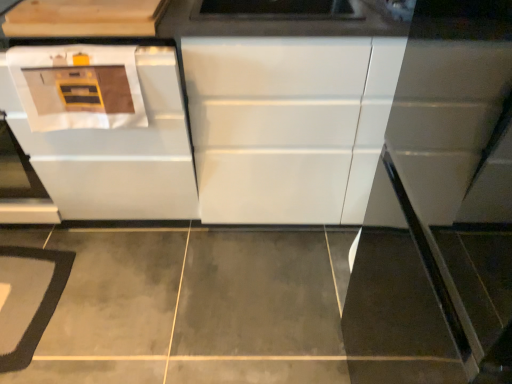
Question: Does light wood cabinet at upper left, the first cabinetry from the left, have a larger size compared to white glossy oven at left?

Choices:
 (A) yes
 (B) no

Answer: (B)

Question: Does light wood cabinet at upper left, the first cabinetry from the left, have a greater width compared to white glossy oven at left?

Choices:
 (A) yes
 (B) no

Answer: (B)

Question: From a real-world perspective, is light wood cabinet at upper left, arranged as the 2th cabinetry when viewed from the right, on white glossy oven at left?

Choices:
 (A) yes
 (B) no

Answer: (A)

Question: Is light wood cabinet at upper left, the first cabinetry from the left, oriented away from white glossy oven at left?

Choices:
 (A) yes
 (B) no

Answer: (B)

Question: Is light wood cabinet at upper left, arranged as the 2th cabinetry when viewed from the right, shorter than white glossy oven at left?

Choices:
 (A) no
 (B) yes

Answer: (B)

Question: Considering the relative sizes of light wood cabinet at upper left, the first cabinetry from the left, and white glossy oven at left in the image provided, is light wood cabinet at upper left, the first cabinetry from the left, taller than white glossy oven at left?

Choices:
 (A) no
 (B) yes

Answer: (A)

Question: Can you confirm if light wood cabinet at upper left, arranged as the 2th cabinetry when viewed from the right, is smaller than white glossy cabinet at center, which is counted as the 2th cabinetry, starting from the left?

Choices:
 (A) no
 (B) yes

Answer: (B)

Question: Is light wood cabinet at upper left, the first cabinetry from the left, closer to the viewer compared to white glossy cabinet at center, which is counted as the 2th cabinetry, starting from the left?

Choices:
 (A) no
 (B) yes

Answer: (B)

Question: Is white glossy cabinet at center, which is counted as the 2th cabinetry, starting from the left, surrounded by light wood cabinet at upper left, arranged as the 2th cabinetry when viewed from the right?

Choices:
 (A) no
 (B) yes

Answer: (A)

Question: From a real-world perspective, is light wood cabinet at upper left, arranged as the 2th cabinetry when viewed from the right, physically below white glossy cabinet at center, which is counted as the 2th cabinetry, starting from the left?

Choices:
 (A) no
 (B) yes

Answer: (A)

Question: Can you confirm if light wood cabinet at upper left, arranged as the 2th cabinetry when viewed from the right, is positioned to the left of white glossy cabinet at center, which is counted as the 2th cabinetry, starting from the left?

Choices:
 (A) no
 (B) yes

Answer: (B)

Question: Are light wood cabinet at upper left, arranged as the 2th cabinetry when viewed from the right, and white glossy cabinet at center, which is counted as the 2th cabinetry, starting from the left, far apart?

Choices:
 (A) yes
 (B) no

Answer: (B)

Question: Is white glossy oven at left oriented towards light wood cabinet at upper left, the first cabinetry from the left?

Choices:
 (A) no
 (B) yes

Answer: (A)